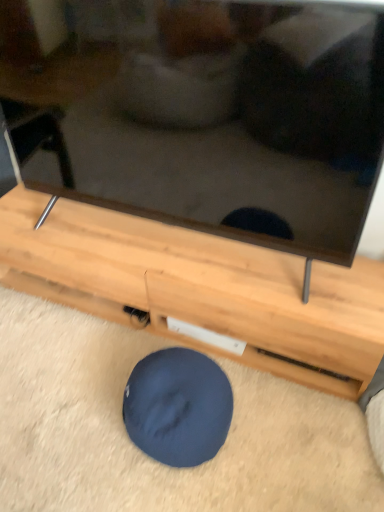
Identify the location of vacant area in front of dark blue fabric dog bed at lower center. The width and height of the screenshot is (384, 512). point(173,489).